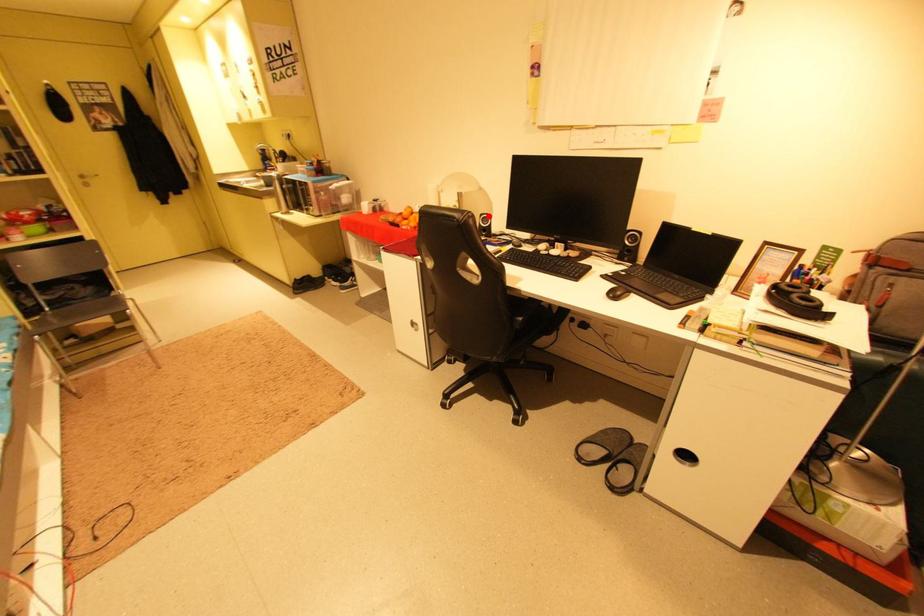
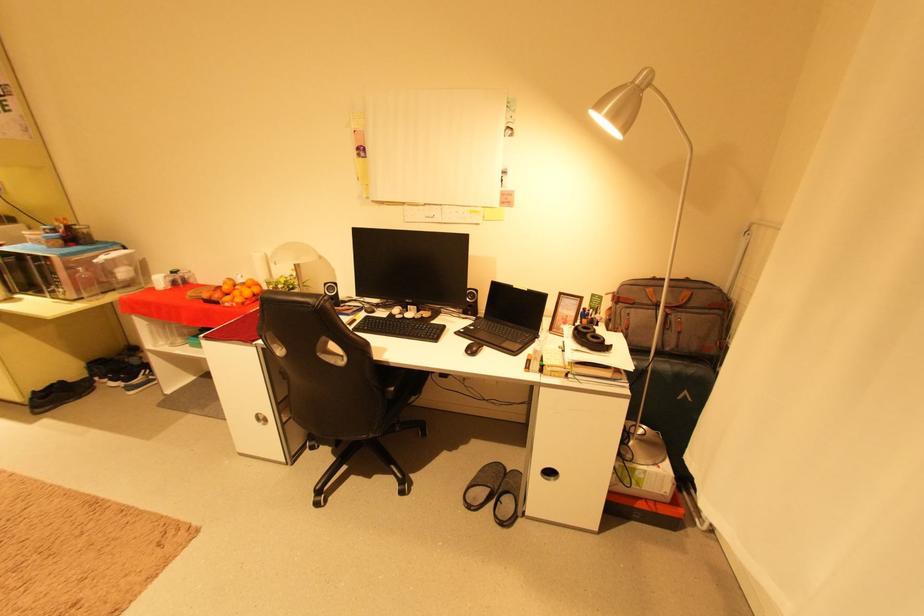
Locate, in the second image, the point that corresponds to the highlighted location in the first image.

(333, 285)